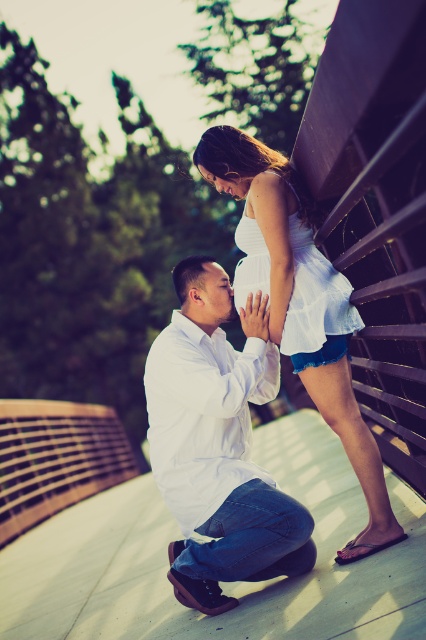
You are an artist sketching this scene. You need to decide which object to draw first based on their sizes. Which one should you start with, the white cotton shirt at lower center or the matte white forehead at upper center?

The white cotton shirt at lower center has a larger size compared to the matte white forehead at upper center, so you should start with the white cotton shirt at lower center first.

You are a photographer capturing this heartfelt scene on the wooden bridge. You notice the white cotton dress at upper center and the matte white belly at center. Which object is closer to the camera lens?

The white cotton dress at upper center is closer to the camera lens because it is positioned in front of the matte white belly at center.